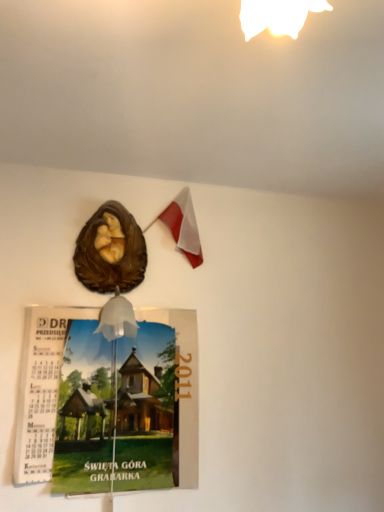
Question: Can polish flag at upper center be found inside brown glossy sculpture at upper center?

Choices:
 (A) yes
 (B) no

Answer: (B)

Question: From the image's perspective, is brown glossy sculpture at upper center located above polish flag at upper center?

Choices:
 (A) yes
 (B) no

Answer: (B)

Question: Is brown glossy sculpture at upper center aimed at polish flag at upper center?

Choices:
 (A) no
 (B) yes

Answer: (A)

Question: Is brown glossy sculpture at upper center next to polish flag at upper center?

Choices:
 (A) no
 (B) yes

Answer: (A)

Question: Can you confirm if brown glossy sculpture at upper center is taller than polish flag at upper center?

Choices:
 (A) yes
 (B) no

Answer: (B)

Question: From a real-world perspective, is brown glossy sculpture at upper center under polish flag at upper center?

Choices:
 (A) no
 (B) yes

Answer: (B)

Question: Considering the relative sizes of polish flag at upper center and brown glossy sculpture at upper center in the image provided, is polish flag at upper center wider than brown glossy sculpture at upper center?

Choices:
 (A) no
 (B) yes

Answer: (A)

Question: Are polish flag at upper center and brown glossy sculpture at upper center making contact?

Choices:
 (A) no
 (B) yes

Answer: (A)

Question: Does polish flag at upper center contain brown glossy sculpture at upper center?

Choices:
 (A) yes
 (B) no

Answer: (B)

Question: Is polish flag at upper center positioned with its back to brown glossy sculpture at upper center?

Choices:
 (A) yes
 (B) no

Answer: (B)

Question: Does polish flag at upper center have a smaller size compared to brown glossy sculpture at upper center?

Choices:
 (A) yes
 (B) no

Answer: (A)

Question: Are polish flag at upper center and brown glossy sculpture at upper center located far from each other?

Choices:
 (A) no
 (B) yes

Answer: (A)

Question: Is matte paper calendar at lower left behind brown glossy sculpture at upper center?

Choices:
 (A) yes
 (B) no

Answer: (B)